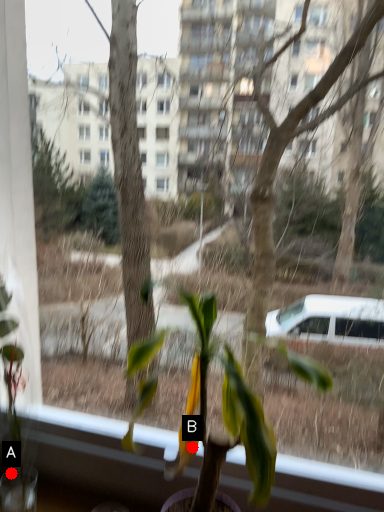
Question: Two points are circled on the image, labeled by A and B beside each circle. Which point is closer to the camera?

Choices:
 (A) A is closer
 (B) B is closer

Answer: (B)